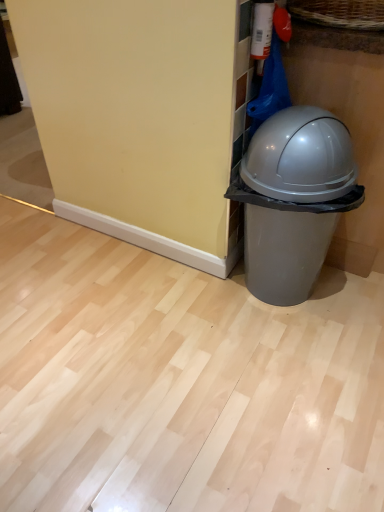
Where is `blank area beneath gray matte plastic trash can at right (from a real-world perspective)`? blank area beneath gray matte plastic trash can at right (from a real-world perspective) is located at coordinates (295, 304).